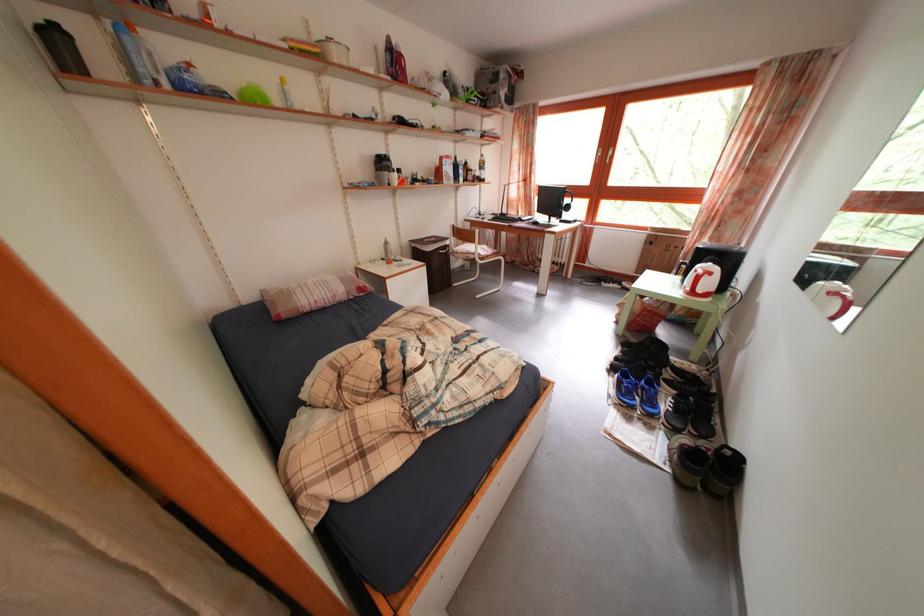
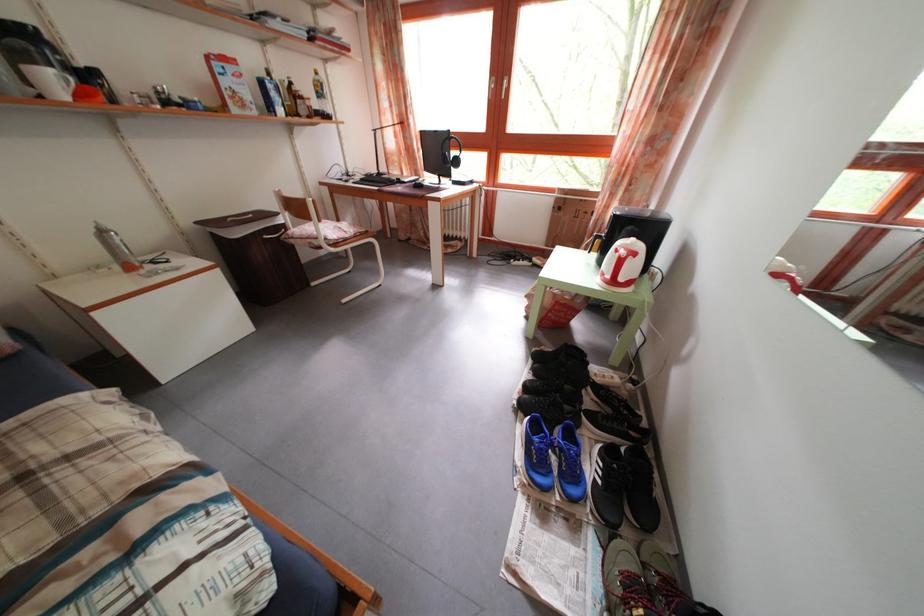
Locate, in the second image, the point that corresponds to (x=528, y=222) in the first image.

(412, 182)